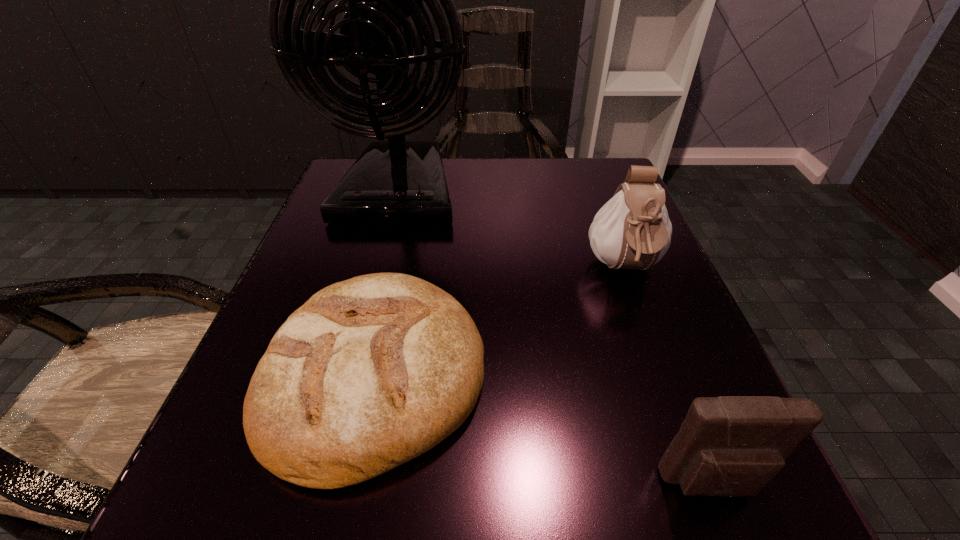
Locate an element on the screen. The image size is (960, 540). free space that is in between the bread and the farther pouch is located at coordinates (499, 322).

In order to click on free space between the shorter pouch and the tallest object in this screenshot , I will do `click(556, 338)`.

Locate which object ranks second in proximity to the shortest object. Please provide its 2D coordinates. Your answer should be formatted as a tuple, i.e. [(x, y)], where the tuple contains the x and y coordinates of a point satisfying the conditions above.

[(632, 230)]

Locate which object is the closest to the shortest object. Please provide its 2D coordinates. Your answer should be formatted as a tuple, i.e. [(x, y)], where the tuple contains the x and y coordinates of a point satisfying the conditions above.

[(396, 181)]

Locate an element on the screen. The image size is (960, 540). blank space that satisfies the following two spatial constraints: 1. in front of the tallest object to blow air; 2. on the left side of the shortest object is located at coordinates (349, 374).

I want to click on blank space that satisfies the following two spatial constraints: 1. in front of the fan to blow air; 2. on the right side of the shortest object, so click(349, 374).

Where is `vacant point that satisfies the following two spatial constraints: 1. in front of the farthest object to blow air; 2. on the left side of the bread`? The image size is (960, 540). vacant point that satisfies the following two spatial constraints: 1. in front of the farthest object to blow air; 2. on the left side of the bread is located at coordinates (349, 374).